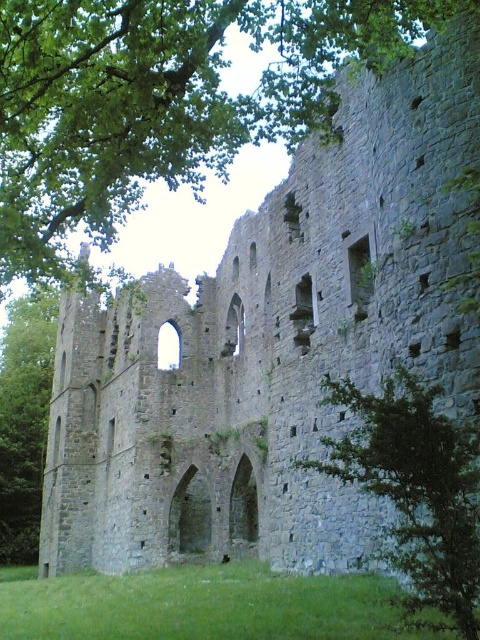
You are standing at the point marked as point (160, 100) in the ruins. What is the nearest object to you?

The nearest object to point (160, 100) is the green leafy tree at upper center since the point is located on it.

You are standing in front of the ruins and notice two green leafy trees in the scene. Which tree, the green leafy tree at upper center or the green leafy tree at lower right, is closer to you?

The green leafy tree at upper center is closer to you because the green leafy tree at lower right is behind it.

You are standing at the entrance of the ruins and want to reach a specific point. You observe two points marked in the image. Which of the two points, point 1 at coordinates (384,13) or point 2 at coordinates (412,522), is farther away from your current position?

Point 1 at coordinates (384,13) is farther away from your current position because it is located behind point 2 at coordinates (412,522).